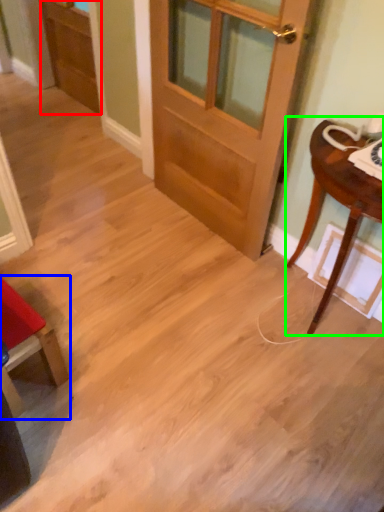
Question: Considering the real-world distances, which object is closest to screen door (highlighted by a red box)? chair (highlighted by a blue box) or table (highlighted by a green box).

Choices:
 (A) chair
 (B) table

Answer: (A)